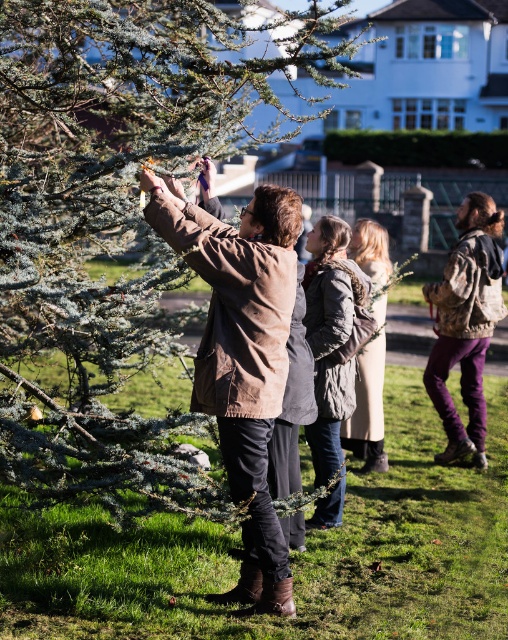
Question: Which object is farther from the camera taking this photo?

Choices:
 (A) green textured pine tree at center
 (B) knitted gray sweater at center

Answer: (B)

Question: Does green textured pine tree at center have a lesser width compared to knitted gray sweater at center?

Choices:
 (A) no
 (B) yes

Answer: (B)

Question: Does green textured pine tree at center have a smaller size compared to knitted gray sweater at center?

Choices:
 (A) yes
 (B) no

Answer: (A)

Question: Which point is closer to the camera taking this photo?

Choices:
 (A) (189, 145)
 (B) (382, 428)

Answer: (A)

Question: Can you confirm if green textured pine tree at center is positioned to the right of textured gray coat at center?

Choices:
 (A) no
 (B) yes

Answer: (A)

Question: Which point is farther to the camera?

Choices:
 (A) (330, 320)
 (B) (381, 464)

Answer: (B)